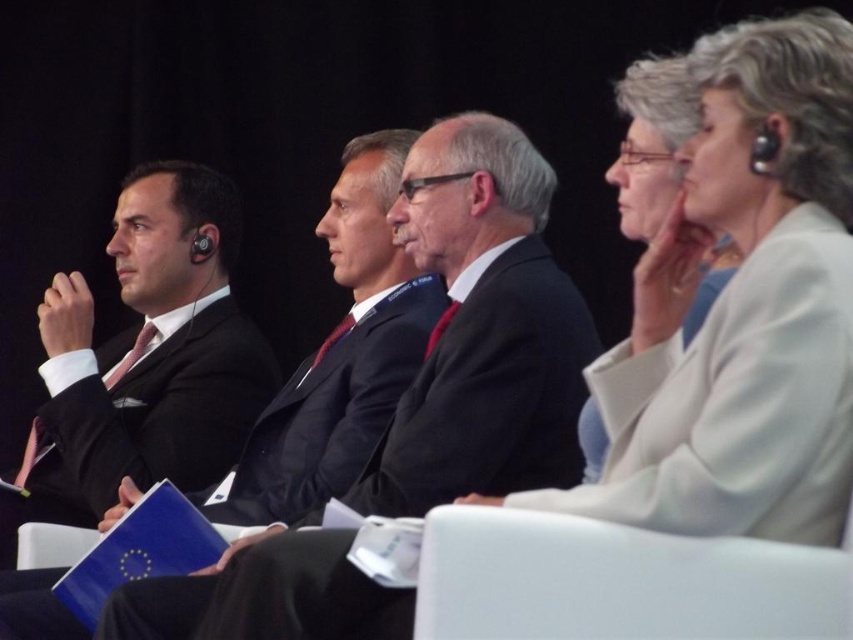
Is black matte suit at left positioned behind matte black suit at left?

No, black matte suit at left is closer to the viewer.

Between black matte suit at left and matte black suit at left, which one appears on the right side from the viewer's perspective?

From the viewer's perspective, black matte suit at left appears more on the right side.

Which is in front, point (111, 637) or point (276, 483)?

Point (111, 637) is in front.

This screenshot has height=640, width=853. What are the coordinates of `black matte suit at left` in the screenshot? It's located at (489, 392).

Can you confirm if black matte suit at left is wider than matte black suit at center?

Indeed, black matte suit at left has a greater width compared to matte black suit at center.

Image resolution: width=853 pixels, height=640 pixels. I want to click on black matte suit at left, so click(x=489, y=392).

Which is behind, point (392, 435) or point (432, 552)?

The point (392, 435) is behind.

Is black matte suit at left above white plastic chair at center?

Indeed, black matte suit at left is positioned over white plastic chair at center.

Image resolution: width=853 pixels, height=640 pixels. Describe the element at coordinates (489, 392) in the screenshot. I see `black matte suit at left` at that location.

The width and height of the screenshot is (853, 640). What are the coordinates of `black matte suit at left` in the screenshot? It's located at pyautogui.click(x=489, y=392).